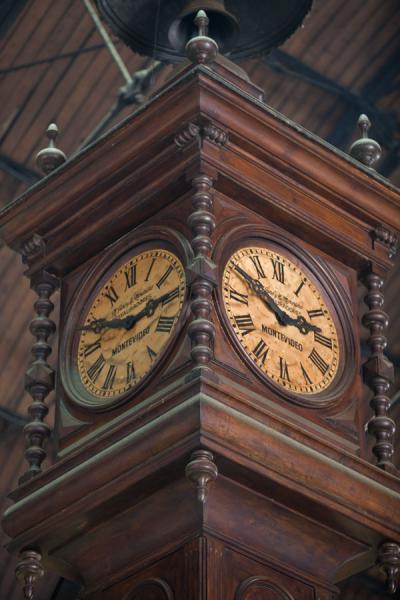
Find the location of a particular element. This screenshot has height=600, width=400. wood spindles is located at coordinates (x=380, y=325), (x=198, y=292), (x=40, y=341), (x=27, y=580), (x=198, y=477), (x=391, y=565), (x=370, y=154), (x=53, y=164).